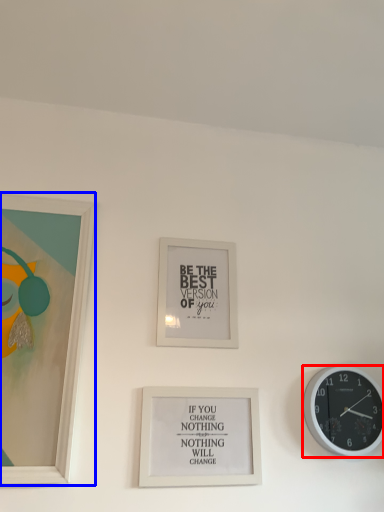
Question: Among these objects, which one is nearest to the camera, wall clock (highlighted by a red box) or picture frame (highlighted by a blue box)?

Choices:
 (A) wall clock
 (B) picture frame

Answer: (B)